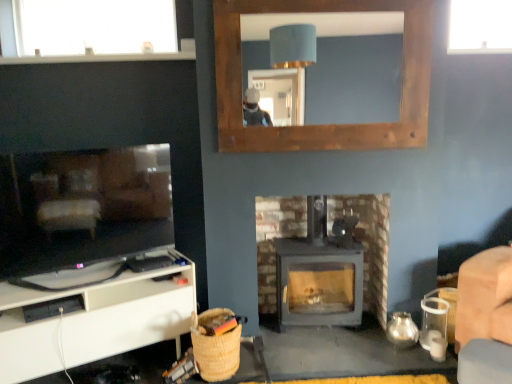
Find the location of `vacant space underneath matte gray wood stove at center (from a real-world perspective)`. vacant space underneath matte gray wood stove at center (from a real-world perspective) is located at coordinates (320, 332).